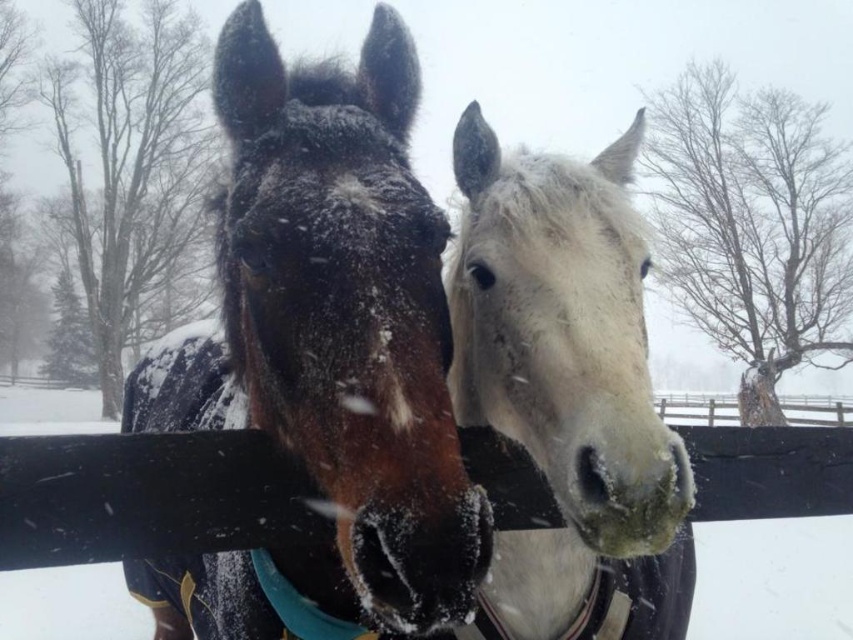
Between point (373, 419) and point (544, 634), which one is positioned in front?

Positioned in front is point (373, 419).

Does point (331, 486) lie behind point (627, 266)?

No, it is in front of (627, 266).

Locate an element on the screen. shiny brown horse at center is located at coordinates (322, 355).